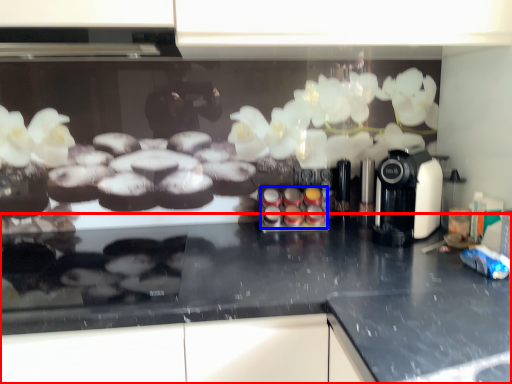
Question: Among these objects, which one is farthest to the camera, countertop (highlighted by a red box) or food (highlighted by a blue box)?

Choices:
 (A) countertop
 (B) food

Answer: (B)